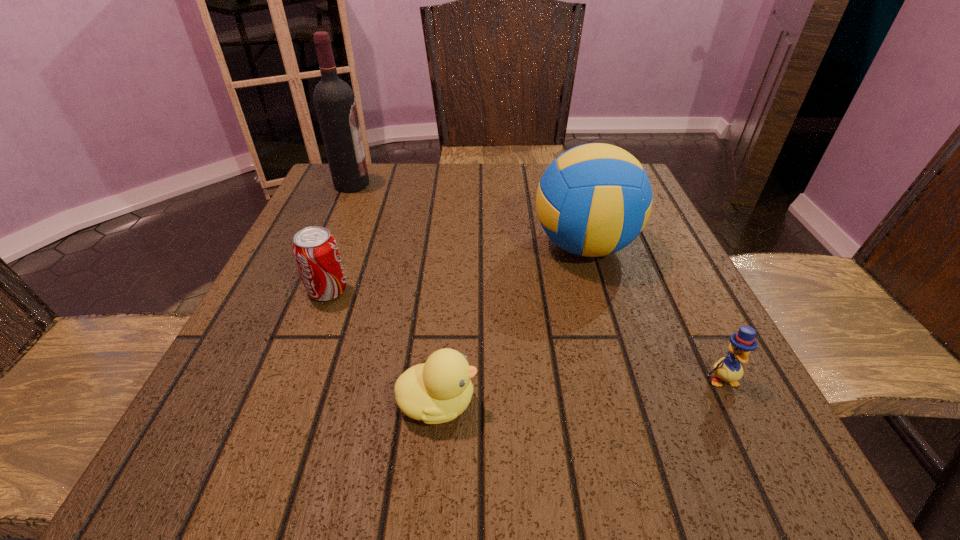
In order to click on free space located 0.060m on the face of the right duckling, where the monocle is placed in this screenshot , I will do `click(746, 428)`.

The width and height of the screenshot is (960, 540). Identify the location of free region located 0.400m at the beak of the third object from right to left. (758, 402).

I want to click on object that is at the far edge, so click(334, 100).

Where is `object situated at the near edge`? This screenshot has width=960, height=540. object situated at the near edge is located at coordinates (437, 391).

This screenshot has width=960, height=540. Find the location of `wine bottle located at the left edge`. wine bottle located at the left edge is located at coordinates (334, 100).

The height and width of the screenshot is (540, 960). I want to click on soda that is at the left edge, so click(x=316, y=253).

The height and width of the screenshot is (540, 960). Find the location of `volleyball that is positioned at the right edge`. volleyball that is positioned at the right edge is located at coordinates (593, 200).

Locate an element on the screen. duckling at the right edge is located at coordinates (729, 369).

Where is `object positioned at the far left corner`? The width and height of the screenshot is (960, 540). object positioned at the far left corner is located at coordinates (334, 100).

Where is `vacant space at the far edge`? The image size is (960, 540). vacant space at the far edge is located at coordinates (469, 176).